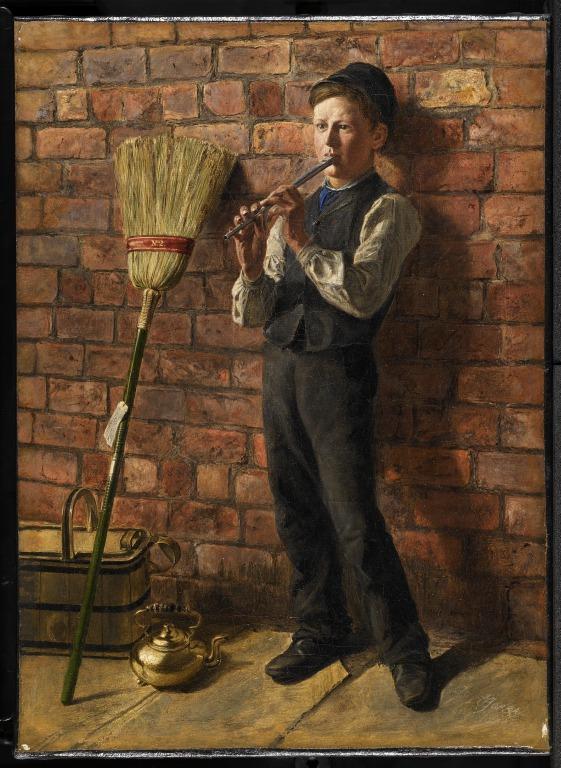
At what (x,y) coordinates should I click in order to perform the action: click on brick wall. Please return your answer as a coordinate pair (x, y). The height and width of the screenshot is (768, 561). Looking at the image, I should click on (170, 84).